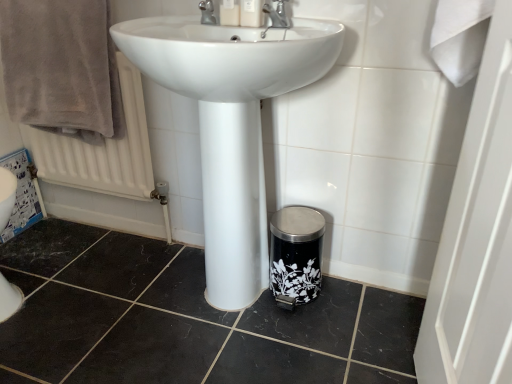
Image resolution: width=512 pixels, height=384 pixels. In order to click on vacant area to the left of white glossy sink at center in this screenshot , I will do `click(94, 301)`.